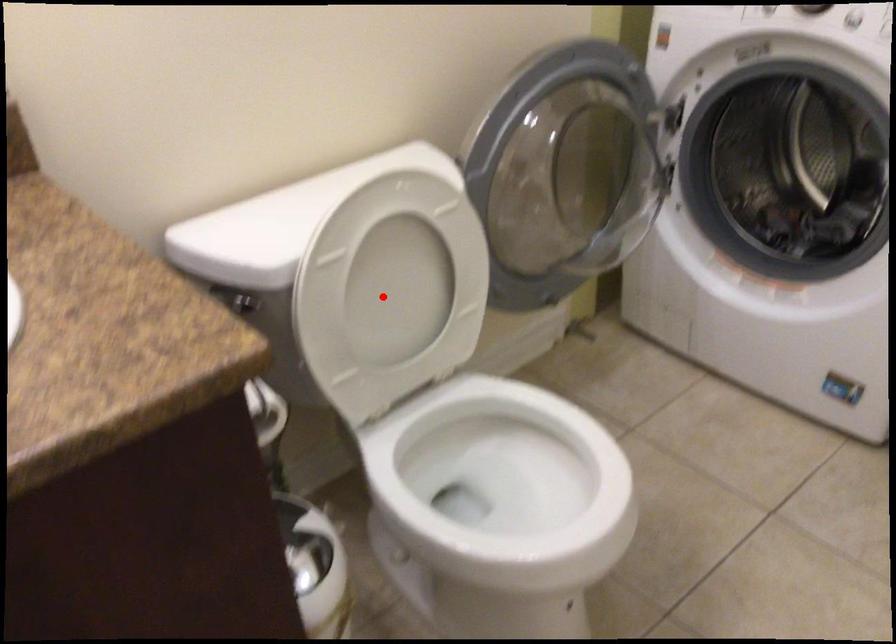
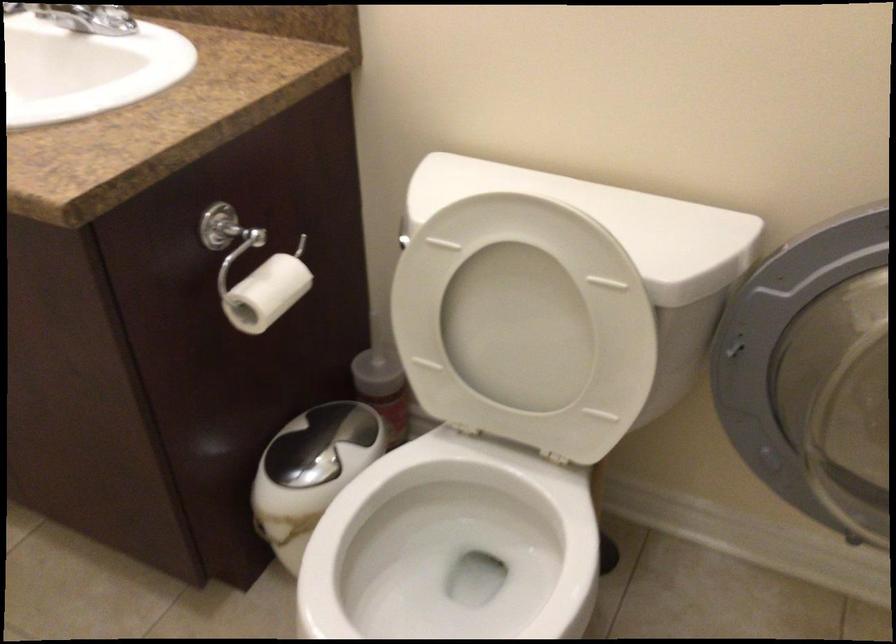
Find the pixel in the second image that matches the highlighted location in the first image.

(517, 328)